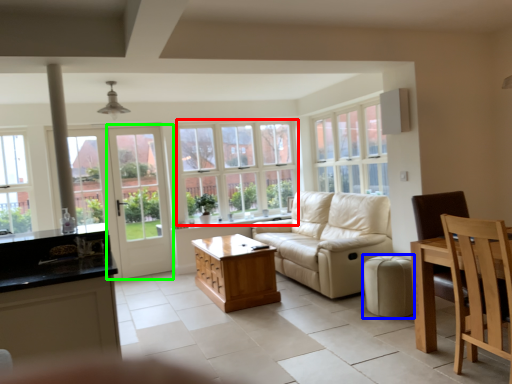
Question: Estimate the real-world distances between objects in this image. Which object is farther from window (highlighted by a red box), stool (highlighted by a blue box) or screen door (highlighted by a green box)?

Choices:
 (A) stool
 (B) screen door

Answer: (A)